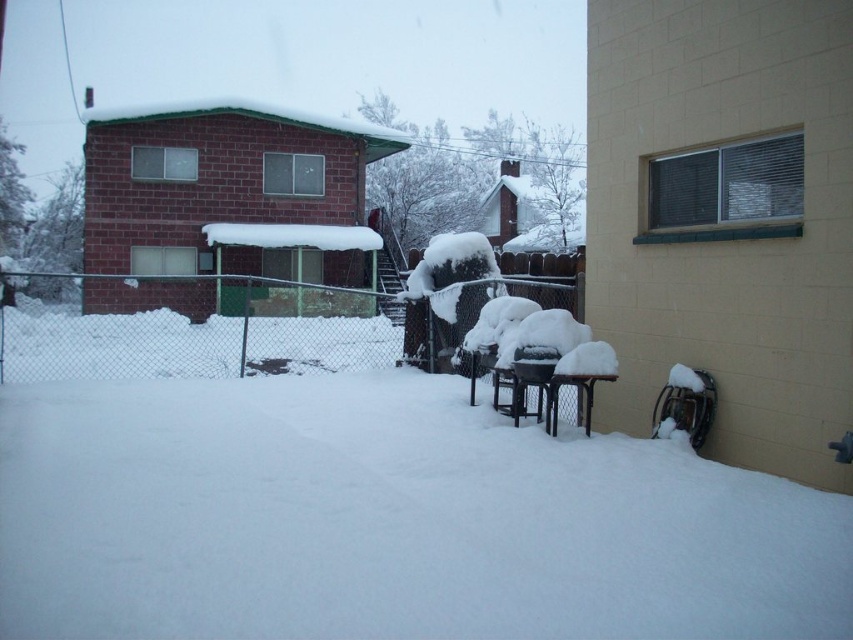
Question: Does white fluffy snow at center have a larger size compared to metallic chain-link fence at center?

Choices:
 (A) no
 (B) yes

Answer: (A)

Question: Which point is closer to the camera?

Choices:
 (A) (161, 337)
 (B) (225, 522)

Answer: (B)

Question: Which of the following is the closest to the observer?

Choices:
 (A) metallic chain-link fence at center
 (B) white fluffy snow at center

Answer: (B)

Question: Considering the relative positions of white fluffy snow at center and metallic chain-link fence at center in the image provided, where is white fluffy snow at center located with respect to metallic chain-link fence at center?

Choices:
 (A) right
 (B) left

Answer: (A)

Question: Is white fluffy snow at center positioned behind metallic chain-link fence at center?

Choices:
 (A) yes
 (B) no

Answer: (B)

Question: Among these points, which one is nearest to the camera?

Choices:
 (A) (328, 330)
 (B) (718, 636)

Answer: (B)